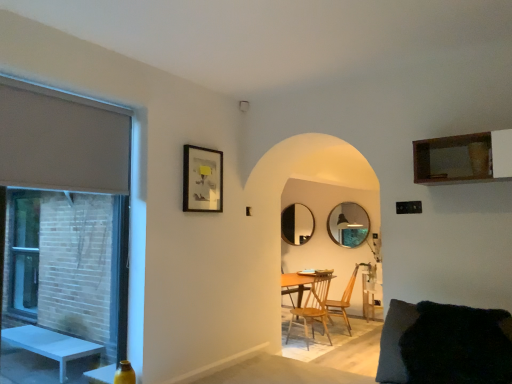
Question: Considering the positions of black glass mirror at center, which ranks as the second mirror in front-to-back order, and wooden shelf at upper right in the image, is black glass mirror at center, which ranks as the second mirror in front-to-back order, bigger or smaller than wooden shelf at upper right?

Choices:
 (A) small
 (B) big

Answer: (A)

Question: Considering the positions of black glass mirror at center, which appears as the 2th mirror when viewed from the right, and wooden shelf at upper right in the image, is black glass mirror at center, which appears as the 2th mirror when viewed from the right, wider or thinner than wooden shelf at upper right?

Choices:
 (A) thin
 (B) wide

Answer: (A)

Question: Estimate the real-world distances between objects in this image. Which object is farther from the matte black picture frame at upper left?

Choices:
 (A) wooden shelf at upper right
 (B) matte gray curtain at left
 (C) wooden chair at center, which ranks as the first chair in right-to-left order
 (D) wooden at center, which is counted as the 2th chair, starting from the back
 (E) black fuzzy pillow at lower right

Answer: (C)

Question: Which object is the closest to the wooden round mirror at center, which is the second mirror from back to front?

Choices:
 (A) black fuzzy pillow at lower right
 (B) matte black picture frame at upper left
 (C) matte glass window at left
 (D) black glass mirror at center, positioned as the first mirror in back-to-front order
 (E) wooden chair at center, the second chair positioned from the front

Answer: (D)